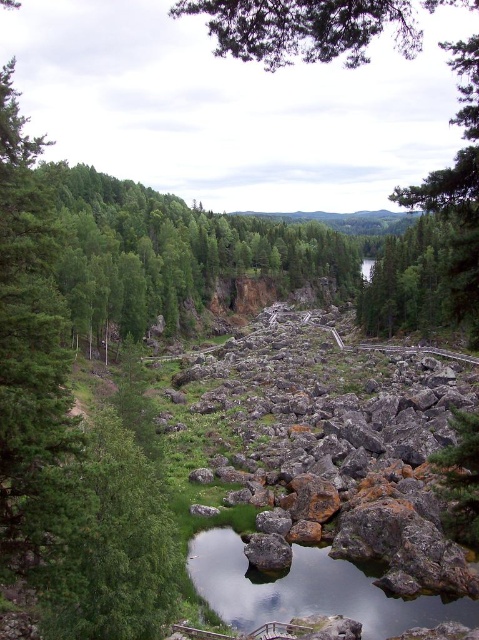
Is point (299, 513) positioned in front of point (275, 580)?

No.

Does point (366, 536) come farther from viewer compared to point (209, 605)?

Yes, point (366, 536) is farther from viewer.

The image size is (479, 640). I want to click on rusty metallic rocks at center, so click(338, 451).

Is point (372, 349) less distant than point (454, 65)?

No, it is not.

Can you confirm if rusty metallic rocks at center is bigger than green leafy tree at center?

Incorrect, rusty metallic rocks at center is not larger than green leafy tree at center.

Which is in front, point (422, 577) or point (262, 26)?

Point (262, 26) is in front.

You are a GUI agent. You are given a task and a screenshot of the screen. Output one action in this format:
    pyautogui.click(x=<x>, y=<y>)
    Task: Click on the rusty metallic rocks at center
    
    Given the screenshot: What is the action you would take?
    pyautogui.click(x=338, y=451)

Can you confirm if green leafy tree at center is positioned below clear water at center?

Actually, green leafy tree at center is above clear water at center.

Does green leafy tree at center have a greater height compared to clear water at center?

Yes.

The image size is (479, 640). Find the location of `green leafy tree at center`. green leafy tree at center is located at coordinates [304, 28].